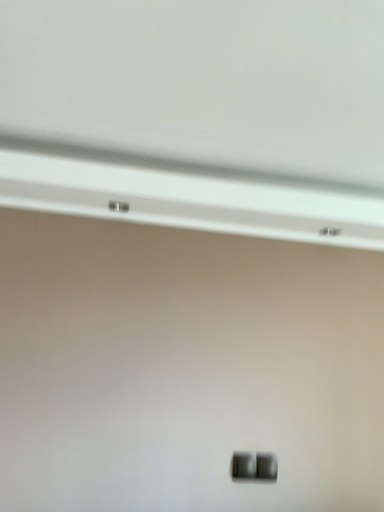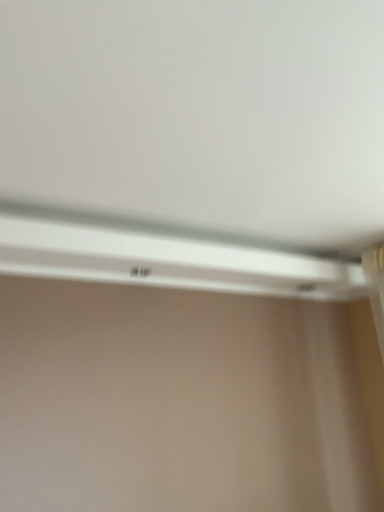
Question: How did the camera likely rotate when shooting the video?

Choices:
 (A) rotated downward
 (B) rotated upward

Answer: (B)